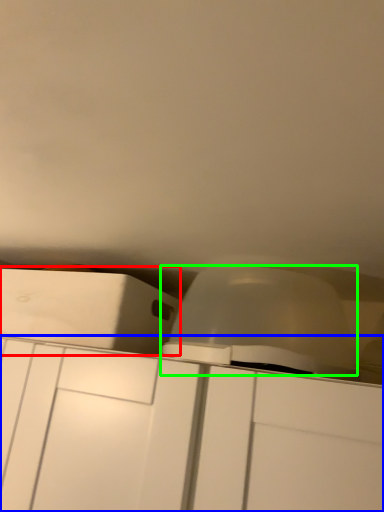
Question: Considering the real-world distances, which object is farthest from cabinetry (highlighted by a red box)? cabinetry (highlighted by a blue box) or lift (highlighted by a green box)?

Choices:
 (A) cabinetry
 (B) lift

Answer: (B)